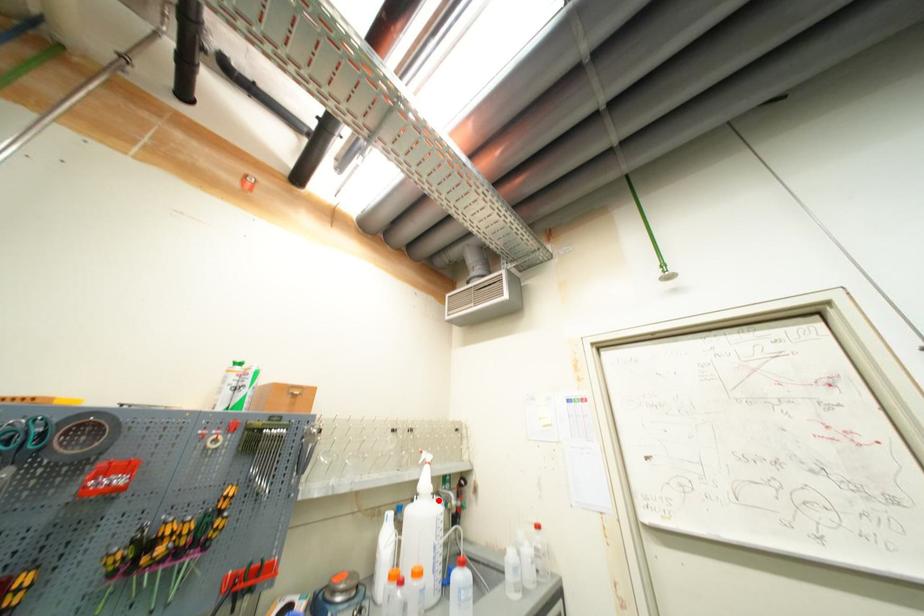
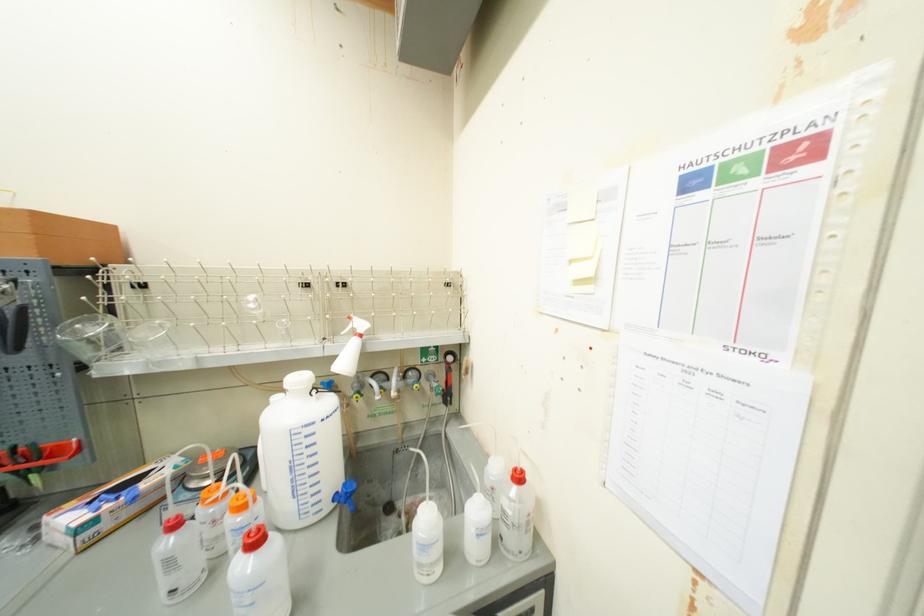
The point at the highlighted location is marked in the first image. Where is the corresponding point in the second image?

(317, 398)